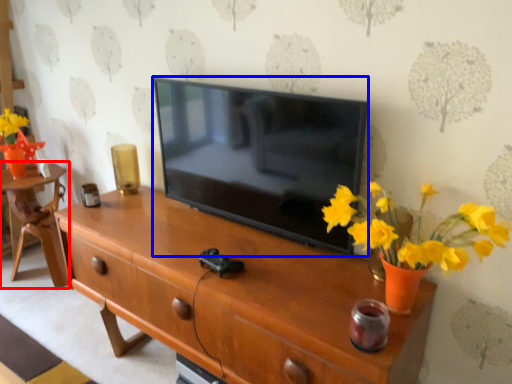
Question: Which of the following is the closest to the observer, table (highlighted by a red box) or television (highlighted by a blue box)?

Choices:
 (A) table
 (B) television

Answer: (B)